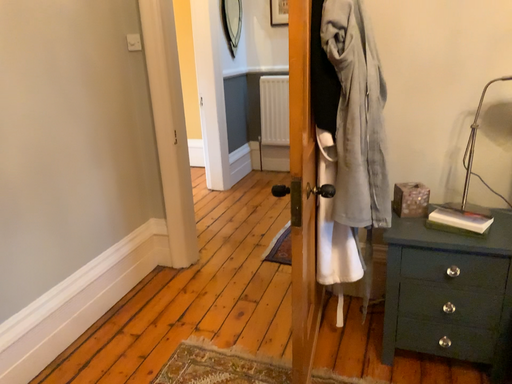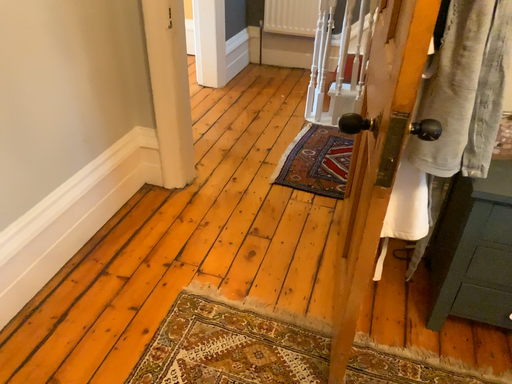
Question: Which way did the camera rotate in the video?

Choices:
 (A) rotated upward
 (B) rotated downward

Answer: (B)